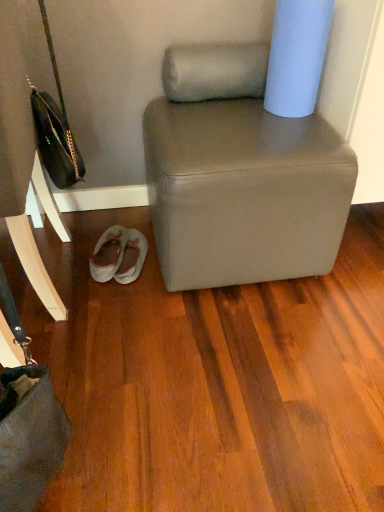
I want to click on vacant area that is in front of light gray suede slippers at lower left, so click(x=113, y=307).